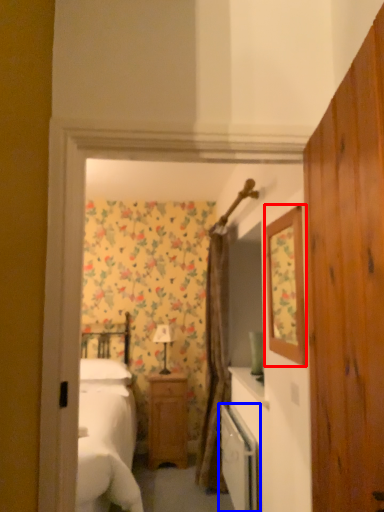
Question: Among these objects, which one is farthest to the camera, mirror (highlighted by a red box) or dish washer (highlighted by a blue box)?

Choices:
 (A) mirror
 (B) dish washer

Answer: (B)